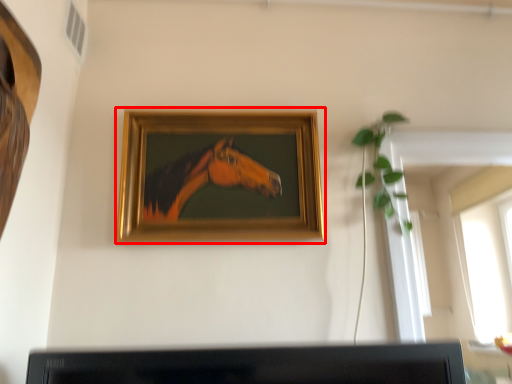
Question: From the image's perspective, where is picture frame (annotated by the red box) located in relation to plant in the image?

Choices:
 (A) above
 (B) below

Answer: (B)